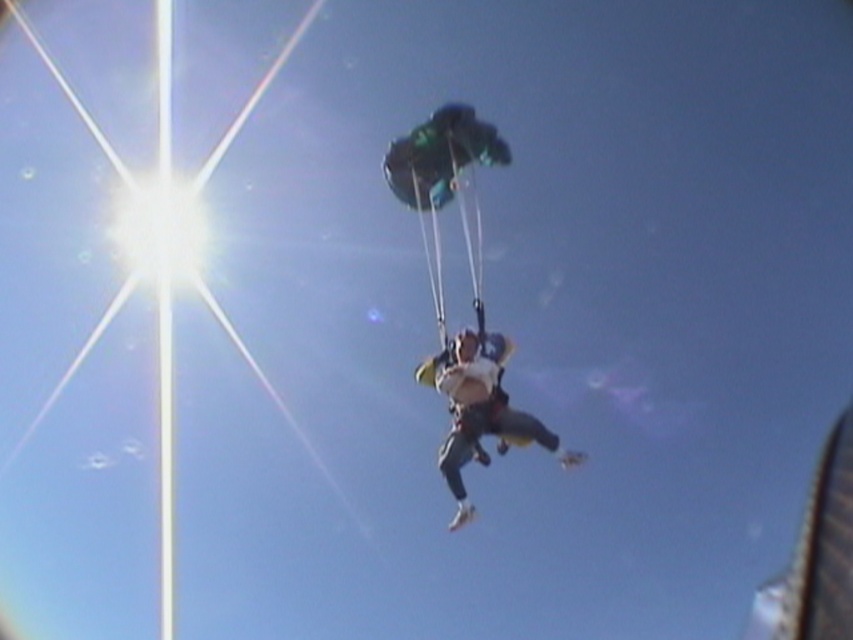
You are a skydiver preparing to deploy your parachute. You see the point at coordinates point (445, 188) in the scene. What object is located at that point?

The point at coordinates point (445, 188) indicates the green fabric parachute at center.

You are a drone operator trying to capture a photo of the skydivers. The camera is set to focus on the point at coordinates point [479,282]. If the camera has a depth of field that can clearly capture objects within 150 meters from the focus point, will the skydivers be in focus?

The distance between point [479,282] and the camera is 164.01 meters. Since the depth of field can only capture objects within 150 meters from the focus point, the skydivers will not be in focus.

You are a skydiving instructor observing two parachutes in the sky. You notice the green fabric parachute at center and the white fabric parachute at center. Which one has a bigger surface area?

The green fabric parachute at center has a larger size compared to the white fabric parachute at center, so the green one has a bigger surface area.